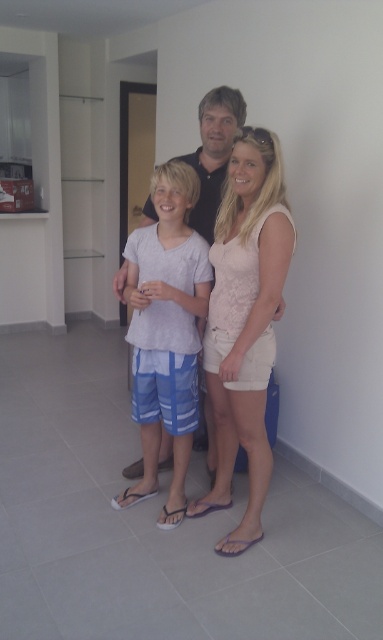
Can you confirm if pale pink lace top at center is positioned below white cotton shirt at center?

No, pale pink lace top at center is not below white cotton shirt at center.

Does pale pink lace top at center have a larger size compared to white cotton shirt at center?

Actually, pale pink lace top at center might be smaller than white cotton shirt at center.

Between point (225, 193) and point (127, 333), which one is positioned behind?

The point (127, 333) is more distant.

Find the location of a particular element. This screenshot has width=383, height=640. pale pink lace top at center is located at coordinates (245, 323).